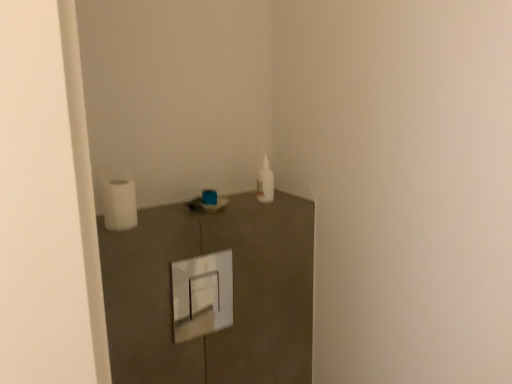
Find the location of a particular element. matte plastic sink at center is located at coordinates (208, 202).

What is the approximate width of matte plastic sink at center?

The width of matte plastic sink at center is 3.80 inches.

Describe the element at coordinates (208, 202) in the screenshot. I see `matte plastic sink at center` at that location.

Describe the element at coordinates (119, 200) in the screenshot. Image resolution: width=512 pixels, height=384 pixels. I see `white matte toilet paper at left` at that location.

Where is `white matte toilet paper at left`? The height and width of the screenshot is (384, 512). white matte toilet paper at left is located at coordinates [119, 200].

Measure the distance between white matte toilet paper at left and camera.

The distance of white matte toilet paper at left from camera is 35.51 inches.

At what (x,y) coordinates should I click in order to perform the action: click on matte plastic sink at center. Please return your answer as a coordinate pair (x, y). This screenshot has width=512, height=384. Looking at the image, I should click on (208, 202).

Which object is positioned more to the left, white matte toilet paper at left or matte plastic sink at center?

white matte toilet paper at left.

Who is more distant, white matte toilet paper at left or matte plastic sink at center?

matte plastic sink at center is more distant.

Is point (127, 174) closer to viewer compared to point (216, 201)?

Yes, it is in front of point (216, 201).

From the image's perspective, which is above, white matte toilet paper at left or matte plastic sink at center?

white matte toilet paper at left.

From a real-world perspective, between white matte toilet paper at left and matte plastic sink at center, who is vertically higher?

From a 3D spatial view, white matte toilet paper at left is above.

Does white matte toilet paper at left have a greater width compared to matte plastic sink at center?

No.

From their relative heights in the image, would you say white matte toilet paper at left is taller or shorter than matte plastic sink at center?

Clearly, white matte toilet paper at left is taller compared to matte plastic sink at center.

Considering the relative sizes of white matte toilet paper at left and matte plastic sink at center in the image provided, is white matte toilet paper at left bigger than matte plastic sink at center?

No.

Is white matte toilet paper at left inside or outside of matte plastic sink at center?

white matte toilet paper at left is not inside matte plastic sink at center, it's outside.

Is white matte toilet paper at left with matte plastic sink at center?

No, white matte toilet paper at left is not beside matte plastic sink at center.

Is white matte toilet paper at left oriented towards matte plastic sink at center?

No, white matte toilet paper at left is not oriented towards matte plastic sink at center.

How different are the orientations of white matte toilet paper at left and matte plastic sink at center in degrees?

The facing directions of white matte toilet paper at left and matte plastic sink at center are 0.00074 degrees apart.

This screenshot has width=512, height=384. Find the location of `sink behind the white matte toilet paper at left`. sink behind the white matte toilet paper at left is located at coordinates (208, 202).

Based on their positions, is matte plastic sink at center located to the left or right of white matte toilet paper at left?

matte plastic sink at center is positioned on white matte toilet paper at left's right side.

Which object is closer to the camera taking this photo, matte plastic sink at center or white matte toilet paper at left?

white matte toilet paper at left.

Considering the positions of points (227, 198) and (111, 222), is point (227, 198) farther from camera compared to point (111, 222)?

Yes, point (227, 198) is behind point (111, 222).

From the image's perspective, is matte plastic sink at center located beneath white matte toilet paper at left?

Correct, matte plastic sink at center appears lower than white matte toilet paper at left in the image.

From a real-world perspective, who is located lower, matte plastic sink at center or white matte toilet paper at left?

matte plastic sink at center.

Considering the relative sizes of matte plastic sink at center and white matte toilet paper at left in the image provided, is matte plastic sink at center thinner than white matte toilet paper at left?

Incorrect, the width of matte plastic sink at center is not less than that of white matte toilet paper at left.

From the picture: Can you confirm if matte plastic sink at center is taller than white matte toilet paper at left?

In fact, matte plastic sink at center may be shorter than white matte toilet paper at left.

Is matte plastic sink at center bigger or smaller than white matte toilet paper at left?

matte plastic sink at center is bigger than white matte toilet paper at left.

From the picture: Does matte plastic sink at center contain white matte toilet paper at left?

No, white matte toilet paper at left is not a part of matte plastic sink at center.

Are matte plastic sink at center and white matte toilet paper at left far apart?

No, there isn't a large distance between matte plastic sink at center and white matte toilet paper at left.

Is matte plastic sink at center looking in the opposite direction of white matte toilet paper at left?

matte plastic sink at center is not turned away from white matte toilet paper at left.

What's the angular difference between matte plastic sink at center and white matte toilet paper at left's facing directions?

There is a 0.00074-degree angle between the facing directions of matte plastic sink at center and white matte toilet paper at left.

This screenshot has height=384, width=512. In the image, there is a white matte toilet paper at left. Identify the location of sink below it (from a real-world perspective). (208, 202).

Find the location of a particular element. sink below the white matte toilet paper at left (from the image's perspective) is located at coordinates (208, 202).

At what (x,y) coordinates should I click in order to perform the action: click on toilet paper located above the matte plastic sink at center (from a real-world perspective). Please return your answer as a coordinate pair (x, y). The width and height of the screenshot is (512, 384). Looking at the image, I should click on (119, 200).